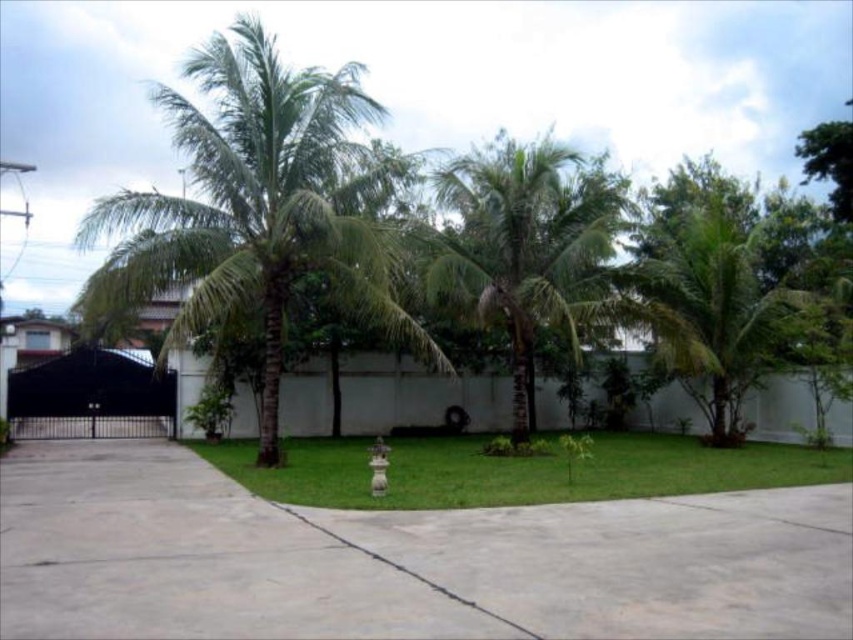
Between green leafy coconut tree at center and green leafy palm tree at center, which one is positioned higher?

Positioned higher is green leafy coconut tree at center.

Who is shorter, green leafy coconut tree at center or green leafy palm tree at center?

green leafy palm tree at center

Describe the element at coordinates (260, 209) in the screenshot. This screenshot has height=640, width=853. I see `green leafy coconut tree at center` at that location.

Locate an element on the screen. Image resolution: width=853 pixels, height=640 pixels. green leafy coconut tree at center is located at coordinates (260, 209).

Is gray concrete pavement at center thinner than green leafy coconut tree at center?

Correct, gray concrete pavement at center's width is less than green leafy coconut tree at center's.

Between gray concrete pavement at center and green leafy coconut tree at center, which one has more height?

Standing taller between the two is green leafy coconut tree at center.

What do you see at coordinates (399, 557) in the screenshot? This screenshot has height=640, width=853. I see `gray concrete pavement at center` at bounding box center [399, 557].

At what (x,y) coordinates should I click in order to perform the action: click on gray concrete pavement at center. Please return your answer as a coordinate pair (x, y). The image size is (853, 640). Looking at the image, I should click on (399, 557).

Can you confirm if gray concrete pavement at center is positioned to the left of green leafy palm tree at center?

Correct, you'll find gray concrete pavement at center to the left of green leafy palm tree at center.

This screenshot has width=853, height=640. I want to click on gray concrete pavement at center, so click(399, 557).

Is point (314, 636) closer to viewer compared to point (555, 176)?

Yes, it is.

Where is `gray concrete pavement at center`? The width and height of the screenshot is (853, 640). gray concrete pavement at center is located at coordinates (399, 557).